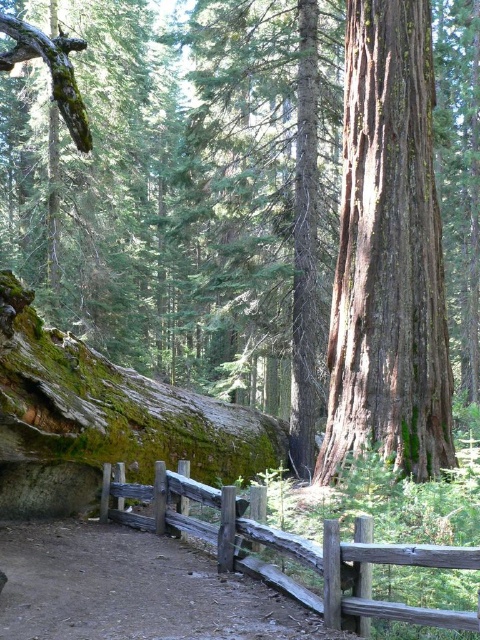
Can you confirm if smooth brown bark at center is positioned below dirt path at center?

Actually, smooth brown bark at center is above dirt path at center.

Does smooth brown bark at center have a greater height compared to dirt path at center?

Indeed, smooth brown bark at center has a greater height compared to dirt path at center.

Which is in front, point (351, 192) or point (168, 616)?

Point (168, 616) is more forward.

Where is `smooth brown bark at center`? This screenshot has height=640, width=480. smooth brown bark at center is located at coordinates (388, 253).

This screenshot has width=480, height=640. I want to click on smooth brown bark at center, so click(x=388, y=253).

Between point (381, 317) and point (415, 618), which one is positioned behind?

The point (381, 317) is behind.

In the scene shown: Who is more forward, (380, 259) or (464, 620)?

Positioned in front is point (464, 620).

The height and width of the screenshot is (640, 480). Identify the location of smooth brown bark at center. (388, 253).

Is dirt path at center bigger than weathered wood fence at lower center?

Yes, dirt path at center is bigger than weathered wood fence at lower center.

Which is in front, point (105, 609) or point (105, 508)?

Point (105, 609)

Does point (80, 560) come farther from viewer compared to point (257, 570)?

Yes.

The height and width of the screenshot is (640, 480). In order to click on dirt path at center in this screenshot , I will do `click(133, 589)`.